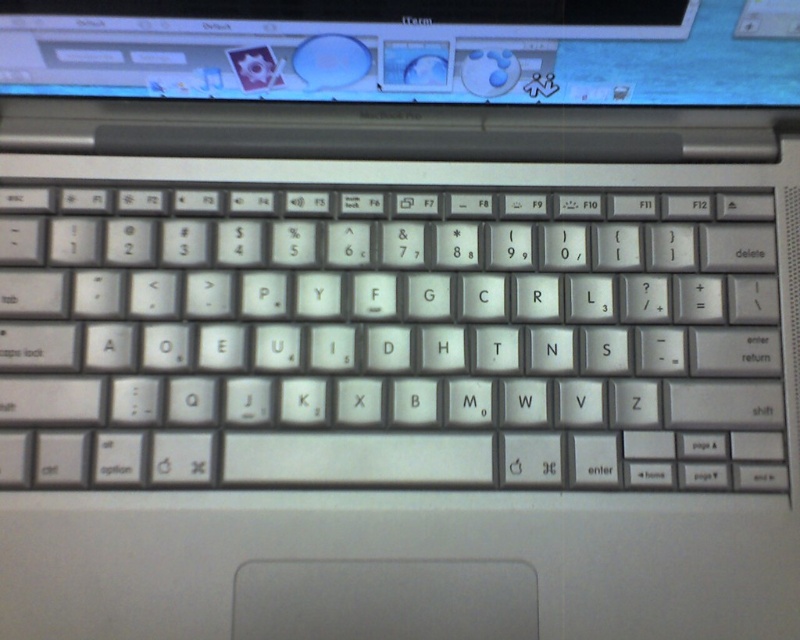
Question: Can you confirm if satin silver keyboard at center is positioned to the right of shiny plastic screen at upper center?

Choices:
 (A) no
 (B) yes

Answer: (A)

Question: Is satin silver keyboard at center bigger than shiny plastic screen at upper center?

Choices:
 (A) no
 (B) yes

Answer: (B)

Question: Considering the relative positions of satin silver keyboard at center and shiny plastic screen at upper center in the image provided, where is satin silver keyboard at center located with respect to shiny plastic screen at upper center?

Choices:
 (A) right
 (B) left

Answer: (B)

Question: Which object is closer to the camera taking this photo?

Choices:
 (A) shiny plastic screen at upper center
 (B) satin silver keyboard at center

Answer: (A)